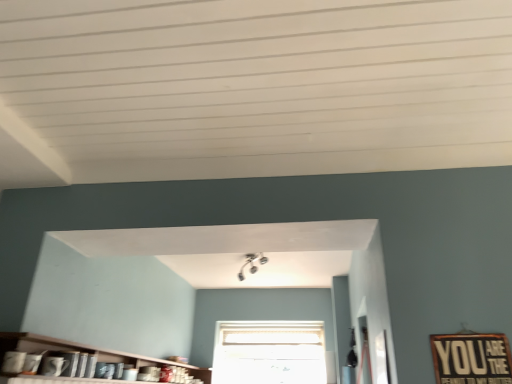
Question: Can you confirm if white frosted glass window at center is taller than matte wooden shelf at lower left?

Choices:
 (A) no
 (B) yes

Answer: (B)

Question: Would you say white frosted glass window at center is a long distance from matte wooden shelf at lower left?

Choices:
 (A) no
 (B) yes

Answer: (B)

Question: Considering the relative sizes of white frosted glass window at center and matte wooden shelf at lower left in the image provided, is white frosted glass window at center bigger than matte wooden shelf at lower left?

Choices:
 (A) yes
 (B) no

Answer: (B)

Question: From a real-world perspective, does white frosted glass window at center sit lower than matte wooden shelf at lower left?

Choices:
 (A) yes
 (B) no

Answer: (B)

Question: Can we say white frosted glass window at center lies outside matte wooden shelf at lower left?

Choices:
 (A) yes
 (B) no

Answer: (A)

Question: Can you confirm if white frosted glass window at center is thinner than matte wooden shelf at lower left?

Choices:
 (A) yes
 (B) no

Answer: (A)

Question: Is matte wooden shelf at lower left located outside white frosted glass window at center?

Choices:
 (A) yes
 (B) no

Answer: (A)

Question: Does matte wooden shelf at lower left have a greater height compared to white frosted glass window at center?

Choices:
 (A) no
 (B) yes

Answer: (A)

Question: Does matte wooden shelf at lower left appear on the left side of white frosted glass window at center?

Choices:
 (A) no
 (B) yes

Answer: (B)

Question: Does matte wooden shelf at lower left lie in front of white frosted glass window at center?

Choices:
 (A) no
 (B) yes

Answer: (B)

Question: From the image's perspective, is matte wooden shelf at lower left below white frosted glass window at center?

Choices:
 (A) yes
 (B) no

Answer: (B)

Question: Could you tell me if matte wooden shelf at lower left is facing white frosted glass window at center?

Choices:
 (A) no
 (B) yes

Answer: (A)

Question: From a real-world perspective, is matte wooden shelf at lower left physically located above or below white frosted glass window at center?

Choices:
 (A) above
 (B) below

Answer: (B)